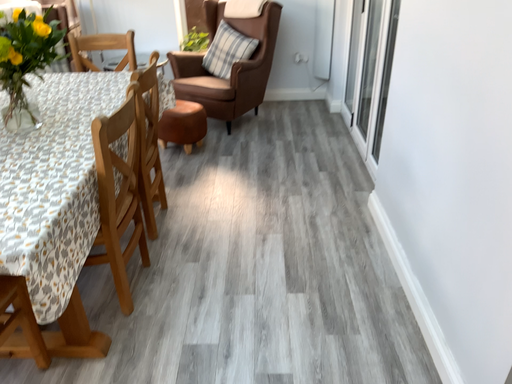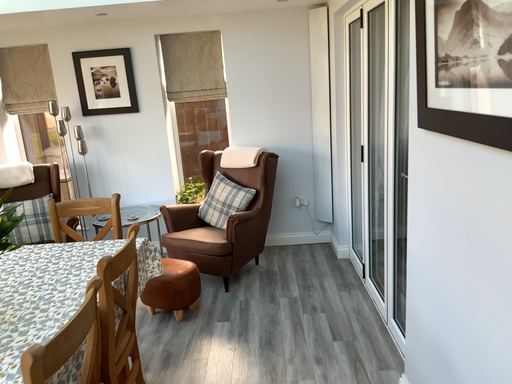
Question: How did the camera likely rotate when shooting the video?

Choices:
 (A) rotated upward
 (B) rotated downward

Answer: (A)